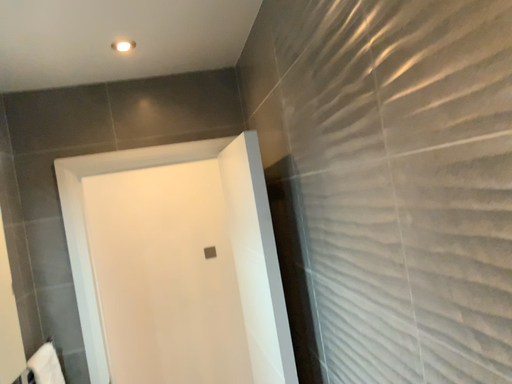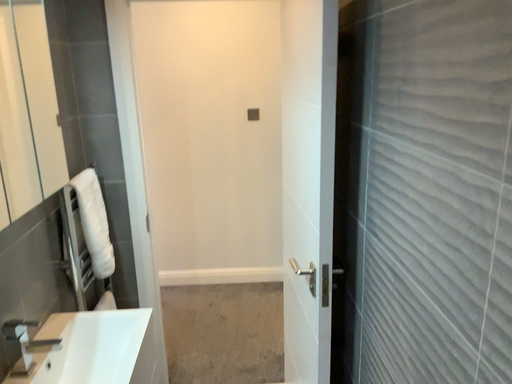
Question: How did the camera likely rotate when shooting the video?

Choices:
 (A) rotated downward
 (B) rotated upward

Answer: (A)